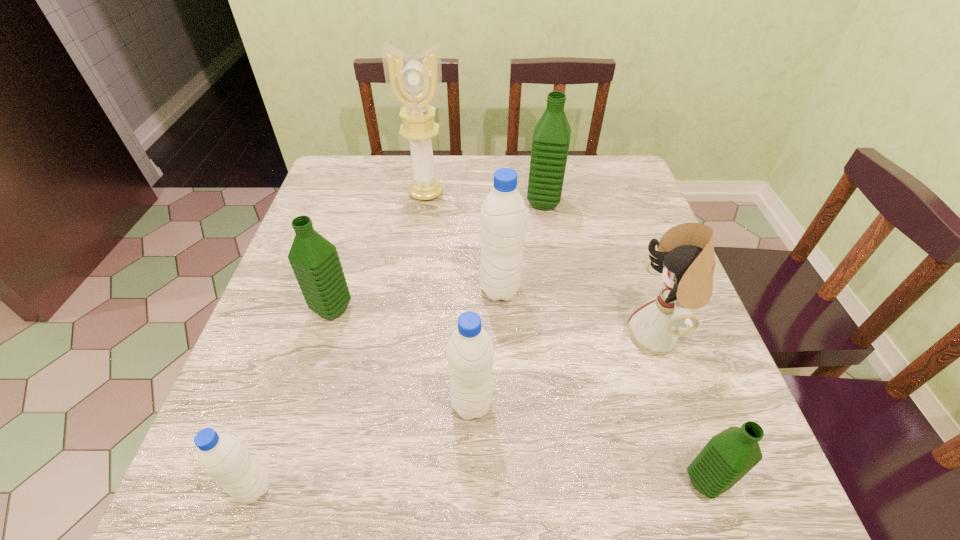
Locate an element on the screen. vacant point located between the nearest gray water bottle and the doll is located at coordinates (456, 412).

The width and height of the screenshot is (960, 540). In order to click on free space between the leftmost green water bottle and the third object from left to right in this screenshot , I will do `click(379, 251)`.

Locate an element on the screen. Image resolution: width=960 pixels, height=540 pixels. vacant area that lies between the rightmost water bottle and the nearest gray water bottle is located at coordinates (479, 485).

Locate an element on the screen. This screenshot has width=960, height=540. vacant area between the farthest green water bottle and the nearest green water bottle is located at coordinates (624, 342).

I want to click on object that can be found as the fourth closest to the fourth farthest water bottle, so tap(222, 456).

Identify which object is the third closest to the third object from left to right. Please provide its 2D coordinates. Your answer should be formatted as a tuple, i.e. [(x, y)], where the tuple contains the x and y coordinates of a point satisfying the conditions above.

[(315, 261)]

Choose which water bottle is the fifth nearest neighbor to the biggest green water bottle. Please provide its 2D coordinates. Your answer should be formatted as a tuple, i.e. [(x, y)], where the tuple contains the x and y coordinates of a point satisfying the conditions above.

[(222, 456)]

Point out which water bottle is positioned as the second nearest to the tallest object. Please provide its 2D coordinates. Your answer should be formatted as a tuple, i.e. [(x, y)], where the tuple contains the x and y coordinates of a point satisfying the conditions above.

[(503, 217)]

Where is `the second closest green water bottle to the rightmost green water bottle`? This screenshot has width=960, height=540. the second closest green water bottle to the rightmost green water bottle is located at coordinates (551, 138).

Locate which green water bottle is the closest to the black doll. Please provide its 2D coordinates. Your answer should be formatted as a tuple, i.e. [(x, y)], where the tuple contains the x and y coordinates of a point satisfying the conditions above.

[(728, 456)]